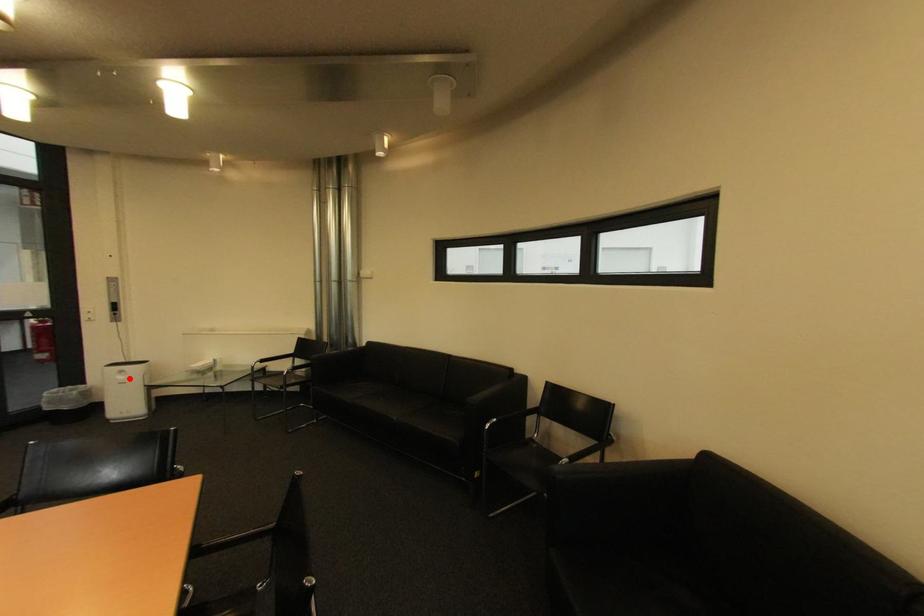
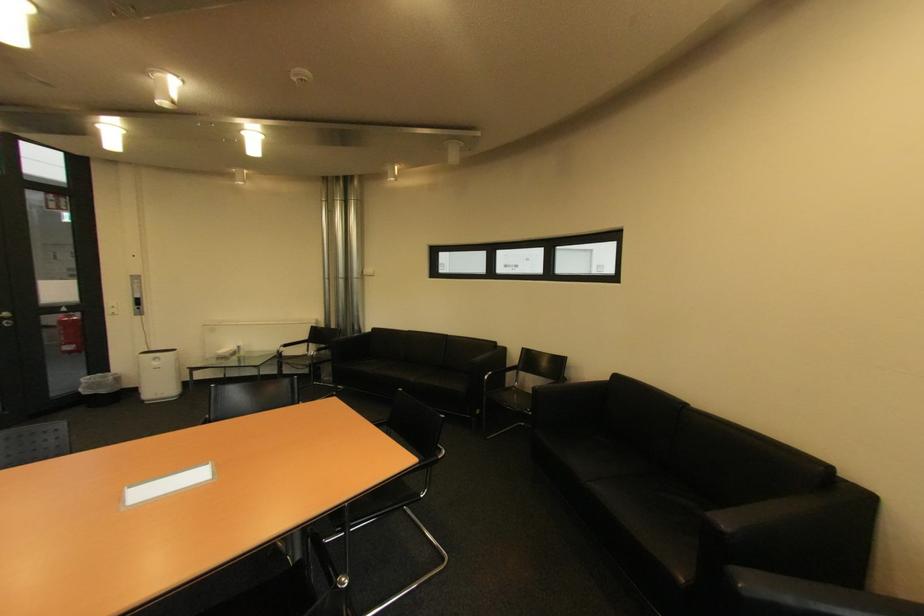
Locate, in the second image, the point that corresponds to the highlighted location in the first image.

(164, 363)